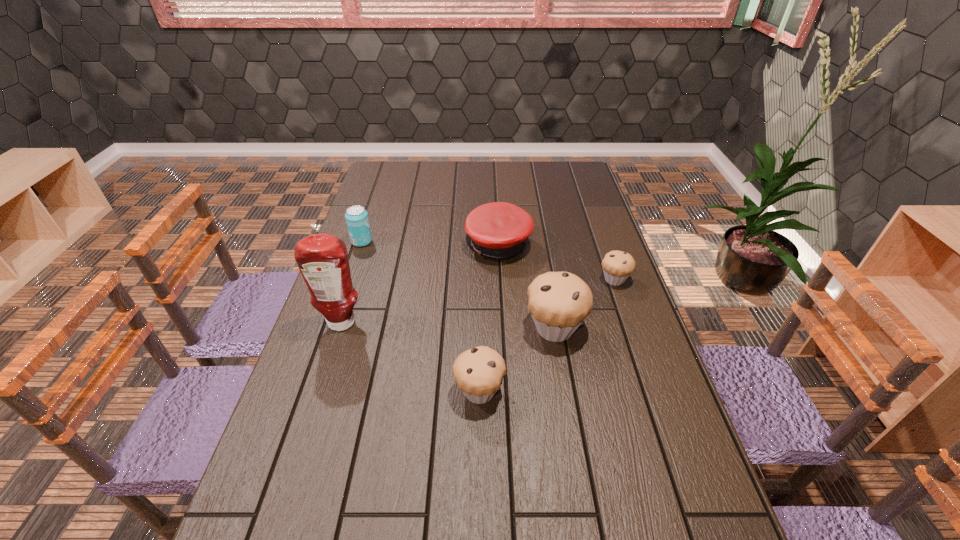
Locate an element on the screen. free space located on the left of the tallest muffin is located at coordinates (431, 328).

You are a GUI agent. You are given a task and a screenshot of the screen. Output one action in this format:
    pyautogui.click(x=<x>, y=<y>)
    Task: Click on the free point located on the left of the third farthest object
    This screenshot has width=960, height=540.
    Given the screenshot: What is the action you would take?
    pyautogui.click(x=490, y=280)

Locate an element on the screen. The image size is (960, 540). vacant space located 0.390m on the front of the beer can is located at coordinates (330, 334).

This screenshot has height=540, width=960. Identify the location of free location located 0.230m on the back of the tallest object. [x=361, y=262].

This screenshot has height=540, width=960. What are the coordinates of `vacant space positioned on the front-facing side of the cap` in the screenshot? It's located at (442, 246).

Image resolution: width=960 pixels, height=540 pixels. In order to click on vacant space situated 0.160m on the front-facing side of the cap in this screenshot , I will do `click(419, 246)`.

This screenshot has height=540, width=960. I want to click on vacant space located 0.070m on the front-facing side of the cap, so click(x=444, y=246).

You are a GUI agent. You are given a task and a screenshot of the screen. Output one action in this format:
    pyautogui.click(x=<x>, y=<y>)
    Task: Click on the beer can that is at the left edge
    
    Given the screenshot: What is the action you would take?
    pyautogui.click(x=357, y=220)

Locate an element on the screen. This screenshot has width=960, height=540. condiment that is at the left edge is located at coordinates (322, 259).

Locate an element on the screen. blank area at the far edge is located at coordinates (430, 181).